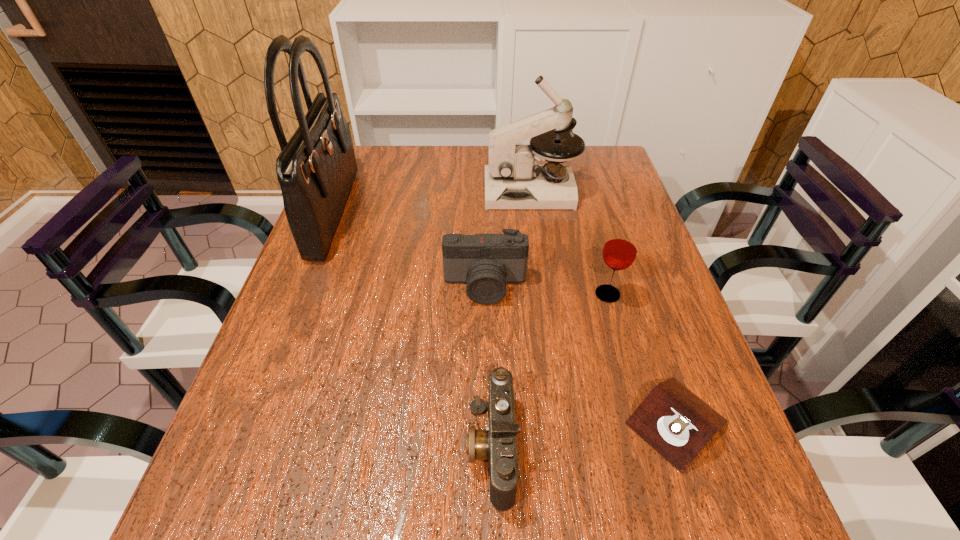
Identify the location of blank region between the handbag and the shortest object. (506, 317).

Where is `vacant region between the fourth shortest object and the book`? The image size is (960, 540). vacant region between the fourth shortest object and the book is located at coordinates (642, 359).

Where is `vacant region between the nearer camera and the shortest object`? The height and width of the screenshot is (540, 960). vacant region between the nearer camera and the shortest object is located at coordinates (584, 435).

Select which object appears as the second closest to the nearer camera. Please provide its 2D coordinates. Your answer should be formatted as a tuple, i.e. [(x, y)], where the tuple contains the x and y coordinates of a point satisfying the conditions above.

[(485, 262)]

Locate an element on the screen. object that stands as the second closest to the microscope is located at coordinates (620, 249).

Where is `free space that satisfies the following two spatial constraints: 1. on the front side of the fourth shortest object; 2. on the right side of the shortest object`? This screenshot has height=540, width=960. free space that satisfies the following two spatial constraints: 1. on the front side of the fourth shortest object; 2. on the right side of the shortest object is located at coordinates (643, 422).

This screenshot has width=960, height=540. What are the coordinates of `vacant point that satisfies the following two spatial constraints: 1. at the eyepiece of the microscope; 2. at the lens of the third shortest object` in the screenshot? It's located at (544, 286).

Locate an element on the screen. free space that satisfies the following two spatial constraints: 1. at the lens of the shortest object; 2. on the right side of the taller camera is located at coordinates (487, 422).

At what (x,y) coordinates should I click in order to perform the action: click on vacant position in the image that satisfies the following two spatial constraints: 1. at the eyepiece of the third tallest object; 2. on the right side of the second tallest object. Please return your answer as a coordinate pair (x, y). Looking at the image, I should click on (545, 294).

Image resolution: width=960 pixels, height=540 pixels. In order to click on free spot that satisfies the following two spatial constraints: 1. with an open clasp on the front of the leftmost object; 2. on the left side of the fourth shortest object in this screenshot , I will do `click(303, 294)`.